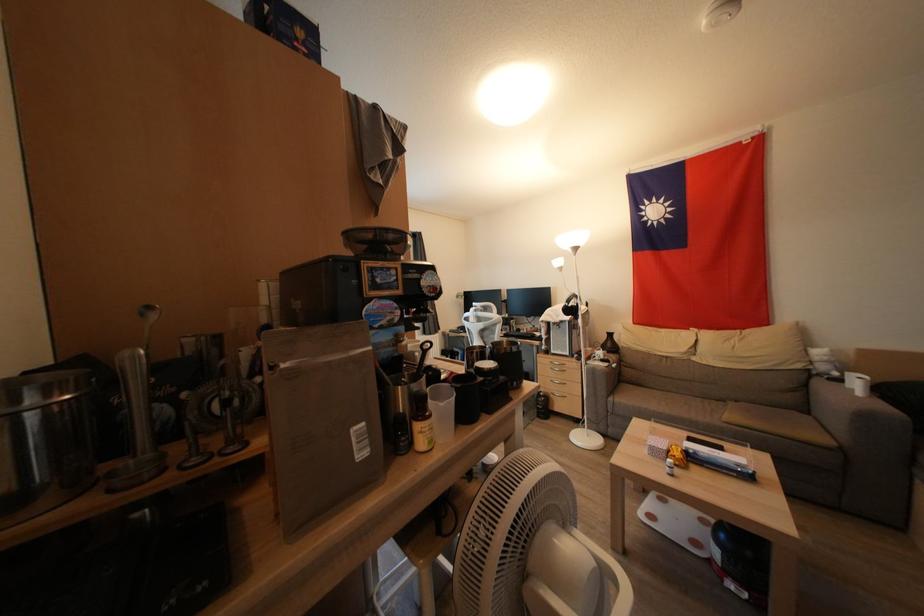
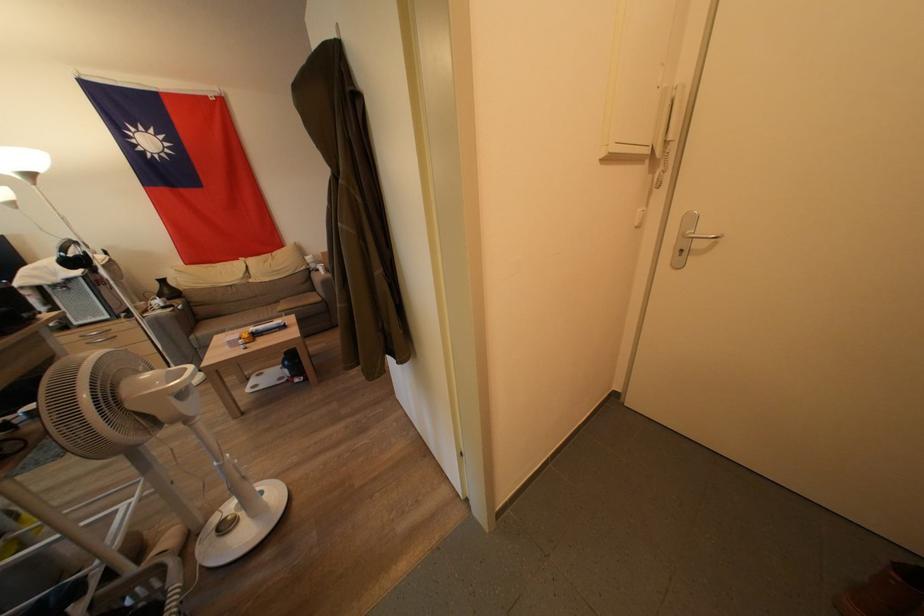
The point at (614, 349) is marked in the first image. Where is the corresponding point in the second image?

(172, 296)